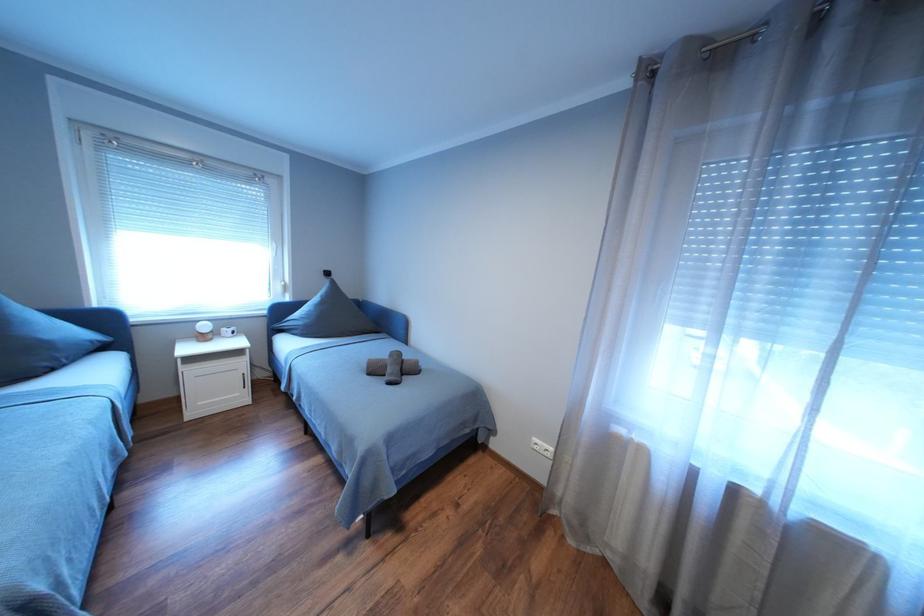
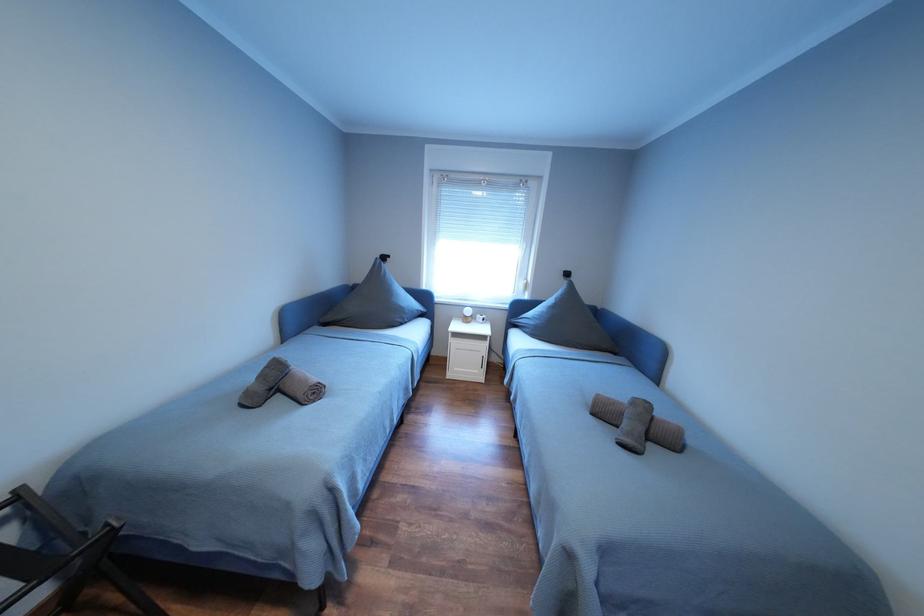
Question: The camera is either moving clockwise (left) or counter-clockwise (right) around the object. The first image is from the beginning of the video and the second image is from the end. Is the camera moving left or right when shooting the video?

Choices:
 (A) Left
 (B) Right

Answer: (B)